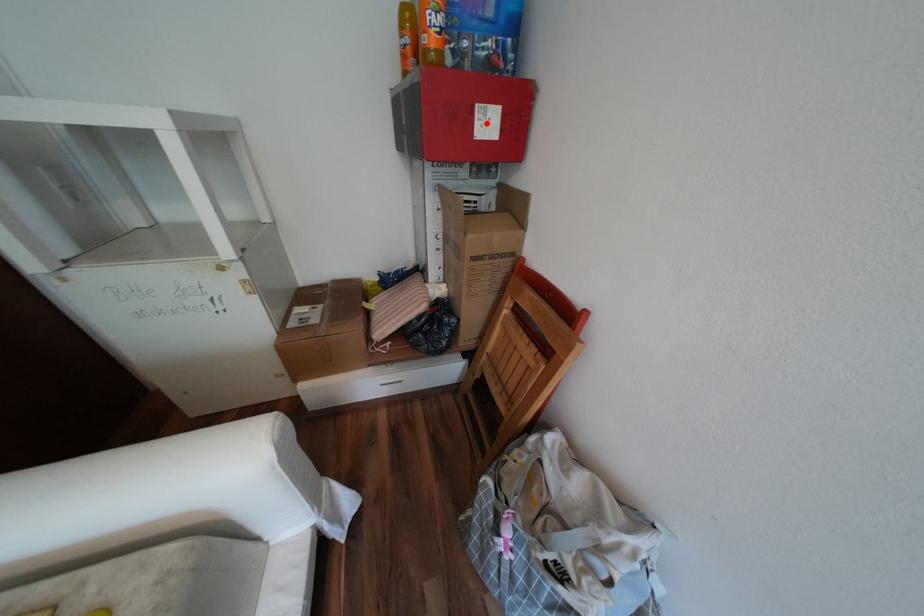
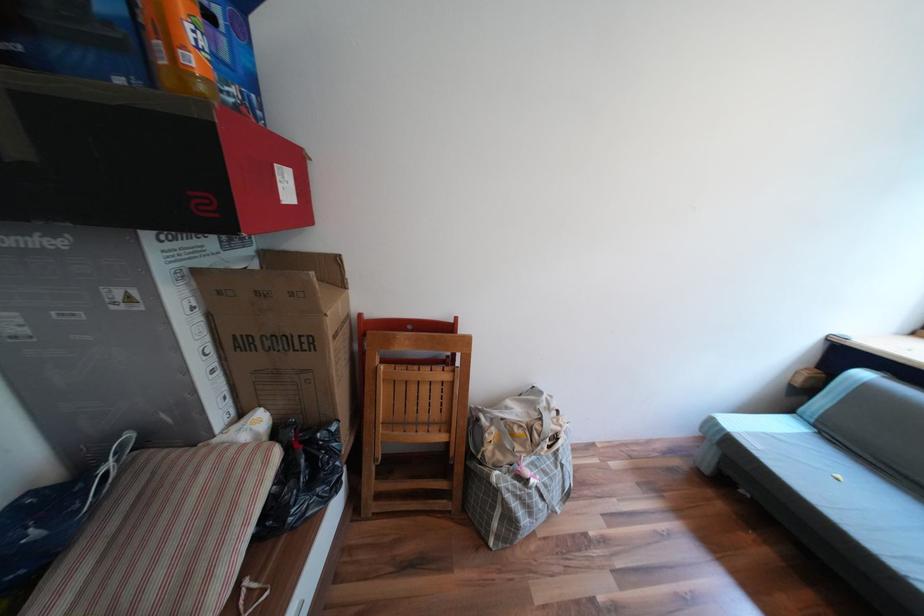
Question: I am providing you with two images of the same scene from different viewpoints. In image1, a red point is highlighted. Considering the same 3D point in image2, which of the following is correct?

Choices:
 (A) It is closer
 (B) It is farther

Answer: (B)